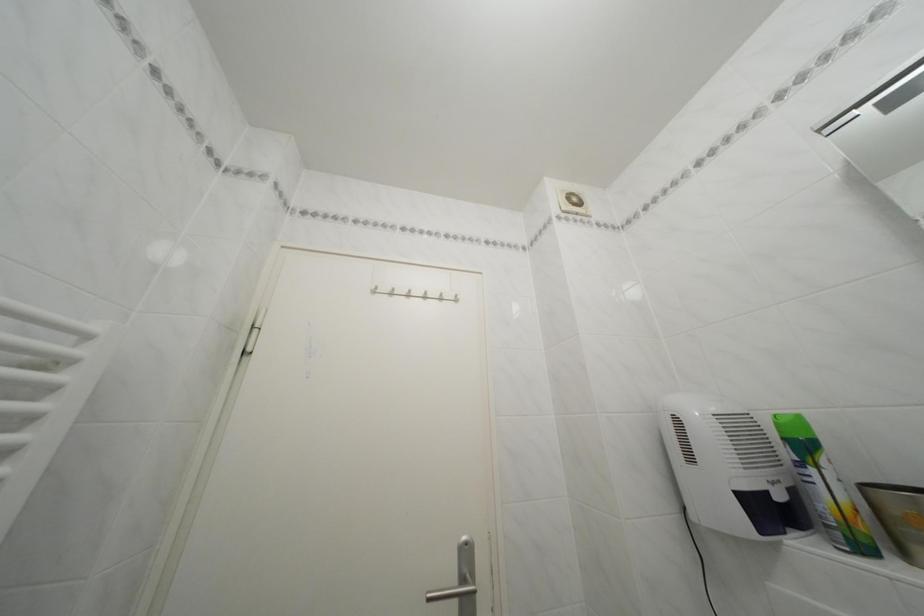
This screenshot has width=924, height=616. Describe the element at coordinates (416, 293) in the screenshot. I see `the white door hooks` at that location.